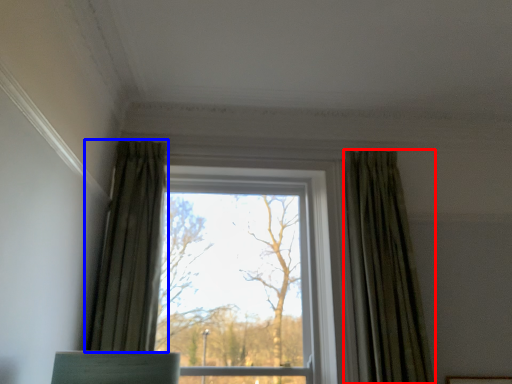
Question: Which point is further to the camera, curtain (highlighted by a red box) or curtain (highlighted by a blue box)?

Choices:
 (A) curtain
 (B) curtain

Answer: (A)